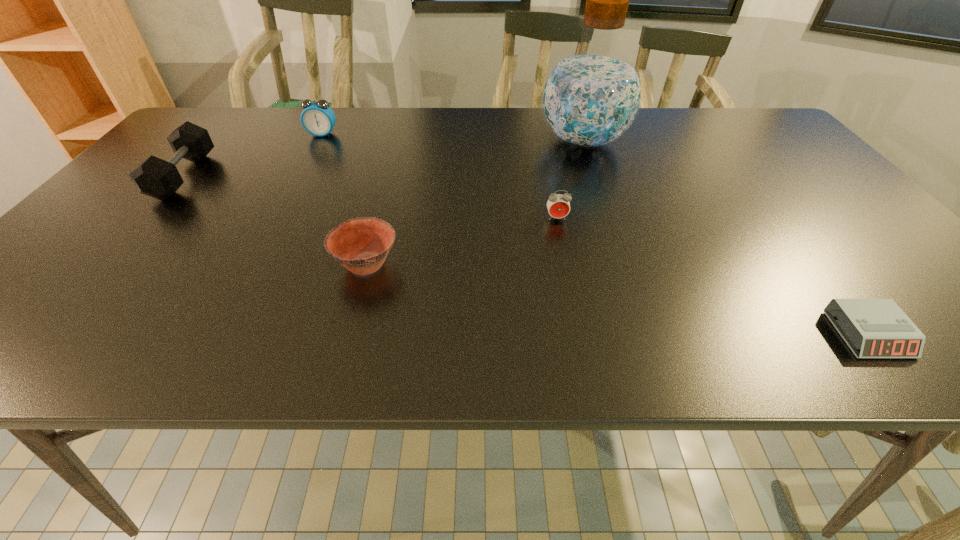
At what (x,y) coordinates should I click in order to perform the action: click on free space located on the front of the water jug. Please return your answer as a coordinate pair (x, y). Looking at the image, I should click on (608, 215).

Where is `free region located 0.400m on the face of the leftmost alarm clock`? free region located 0.400m on the face of the leftmost alarm clock is located at coordinates (276, 221).

Locate an element on the screen. This screenshot has height=540, width=960. vacant area situated on the back of the leftmost object is located at coordinates (226, 129).

Where is `vacant point located 0.360m on the face of the third nearest object`? vacant point located 0.360m on the face of the third nearest object is located at coordinates (584, 350).

Locate an element on the screen. Image resolution: width=960 pixels, height=540 pixels. free space located 0.100m on the right of the fourth object from right to left is located at coordinates (447, 264).

The height and width of the screenshot is (540, 960). I want to click on vacant space located on the back of the rightmost alarm clock, so click(821, 274).

Find the location of a particular element. water jug situated at the far edge is located at coordinates (591, 96).

What are the coordinates of `alarm clock situated at the far edge` in the screenshot? It's located at (317, 118).

Locate an element on the screen. Image resolution: width=960 pixels, height=540 pixels. object that is at the near edge is located at coordinates (878, 328).

Locate an element on the screen. This screenshot has width=960, height=540. object located in the left edge section of the desktop is located at coordinates click(x=154, y=177).